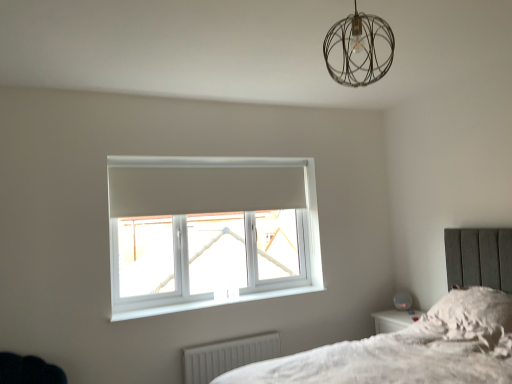
Question: Is white ribbed radiator at lower center turned away from white plastic window at center?

Choices:
 (A) no
 (B) yes

Answer: (A)

Question: Does white ribbed radiator at lower center have a lesser height compared to white plastic window at center?

Choices:
 (A) no
 (B) yes

Answer: (B)

Question: Are white ribbed radiator at lower center and white plastic window at center far apart?

Choices:
 (A) yes
 (B) no

Answer: (B)

Question: From the image's perspective, would you say white ribbed radiator at lower center is shown under white plastic window at center?

Choices:
 (A) yes
 (B) no

Answer: (A)

Question: From a real-world perspective, is white ribbed radiator at lower center located beneath white plastic window at center?

Choices:
 (A) no
 (B) yes

Answer: (B)

Question: From the image's perspective, is white ribbed radiator at lower center located above or below fluffy white pillow at lower right?

Choices:
 (A) below
 (B) above

Answer: (A)

Question: Considering the positions of white ribbed radiator at lower center and fluffy white pillow at lower right in the image, is white ribbed radiator at lower center taller or shorter than fluffy white pillow at lower right?

Choices:
 (A) short
 (B) tall

Answer: (B)

Question: Looking at their shapes, would you say white ribbed radiator at lower center is wider or thinner than fluffy white pillow at lower right?

Choices:
 (A) wide
 (B) thin

Answer: (B)

Question: Considering the positions of white ribbed radiator at lower center and fluffy white pillow at lower right in the image, is white ribbed radiator at lower center bigger or smaller than fluffy white pillow at lower right?

Choices:
 (A) big
 (B) small

Answer: (B)

Question: Choose the correct answer: Is white plastic window sill at lower center inside white plastic window at center or outside it?

Choices:
 (A) inside
 (B) outside

Answer: (B)

Question: Is white plastic window sill at lower center bigger or smaller than white plastic window at center?

Choices:
 (A) big
 (B) small

Answer: (B)

Question: Considering the positions of white plastic window sill at lower center and white plastic window at center in the image, is white plastic window sill at lower center wider or thinner than white plastic window at center?

Choices:
 (A) wide
 (B) thin

Answer: (A)

Question: From the image's perspective, relative to white plastic window at center, is white plastic window sill at lower center above or below?

Choices:
 (A) above
 (B) below

Answer: (B)

Question: Would you say fluffy white pillow at lower right is to the left or to the right of white plastic window at center in the picture?

Choices:
 (A) right
 (B) left

Answer: (A)

Question: Considering the positions of fluffy white pillow at lower right and white plastic window at center in the image, is fluffy white pillow at lower right bigger or smaller than white plastic window at center?

Choices:
 (A) small
 (B) big

Answer: (A)